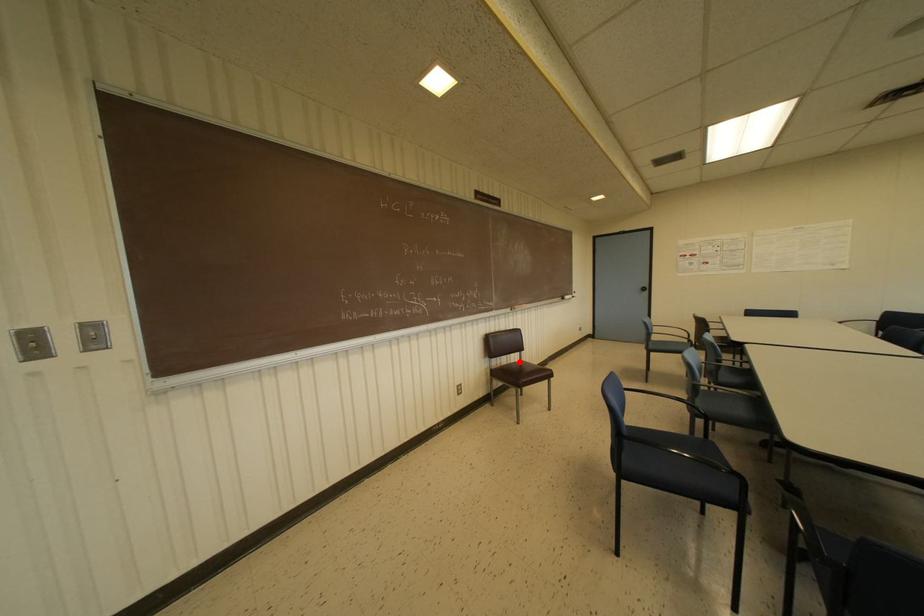
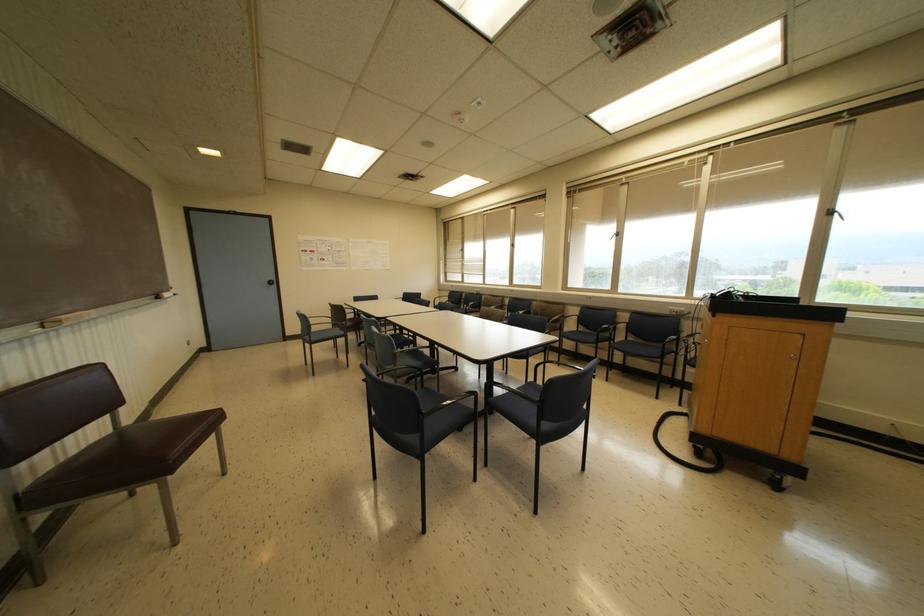
Question: I am providing you with two images of the same scene from different viewpoints. A red point is shown in image1. For the corresponding object point in image2, is it positioned nearer or farther from the camera?

Choices:
 (A) Nearer
 (B) Farther

Answer: (A)